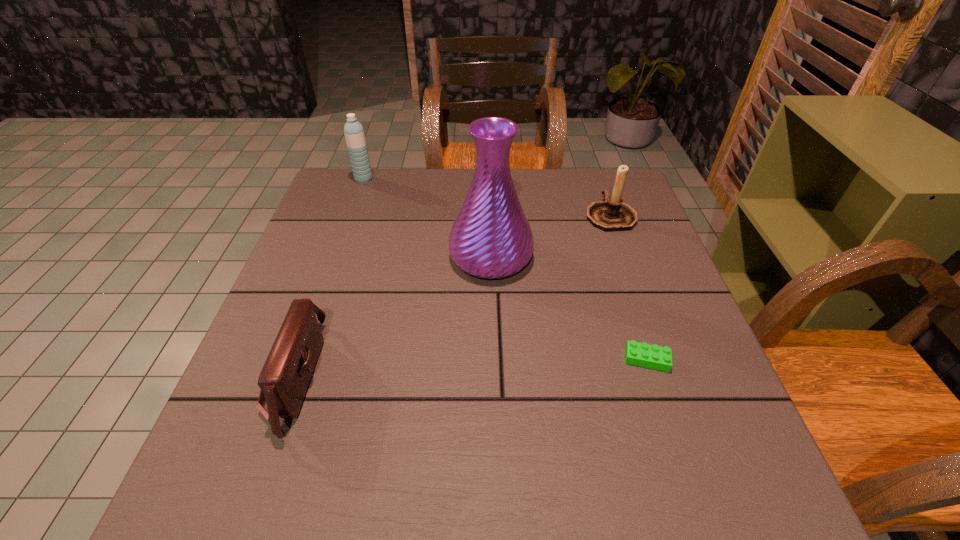
Locate an element on the screen. The width and height of the screenshot is (960, 540). free point that satisfies the following two spatial constraints: 1. on the front side of the vase; 2. on the right side of the fourth shortest object is located at coordinates (337, 256).

Locate an element on the screen. free space that satisfies the following two spatial constraints: 1. on the front side of the second tallest object; 2. on the front flap of the shoulder bag is located at coordinates [294, 377].